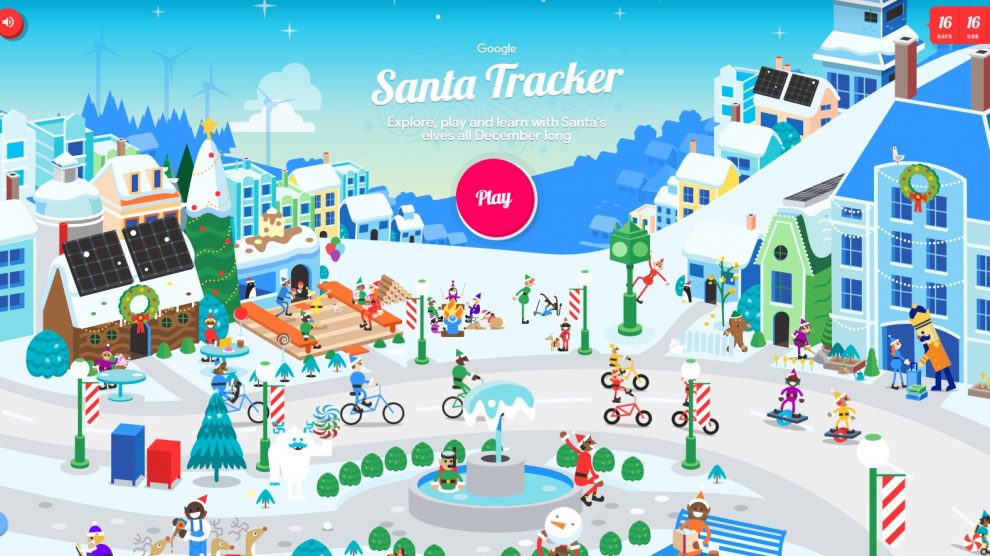
In order to click on green christmas tree in this screenshot , I will do `click(212, 257)`.